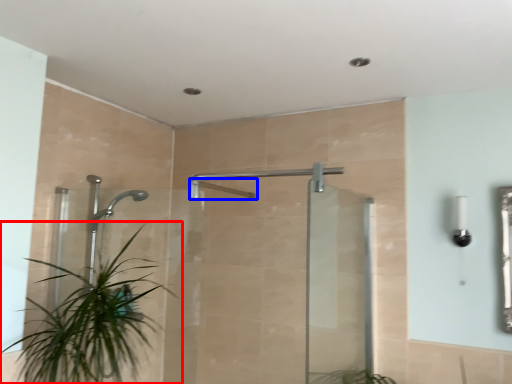
Question: Which point is closer to the camera, houseplant (highlighted by a red box) or shower (highlighted by a blue box)?

Choices:
 (A) houseplant
 (B) shower

Answer: (A)